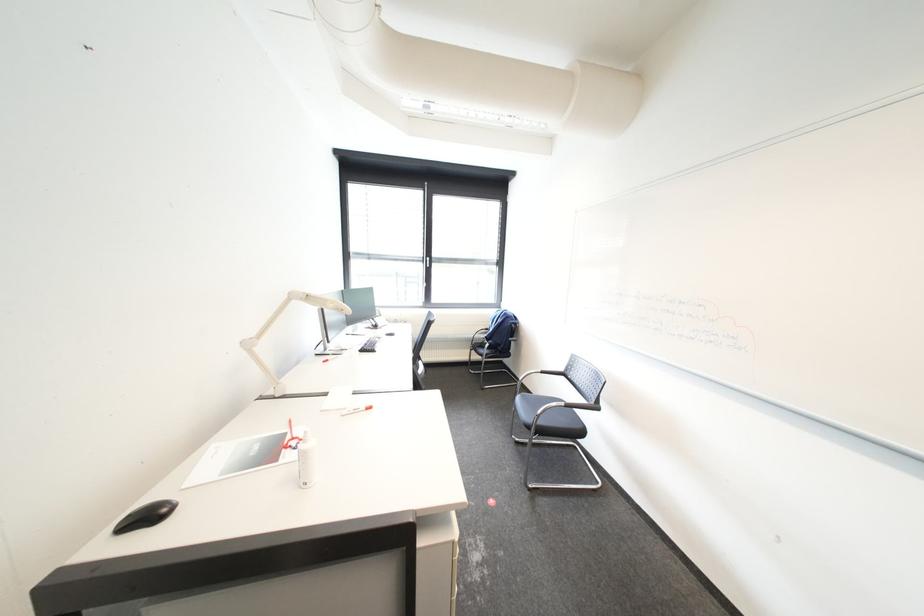
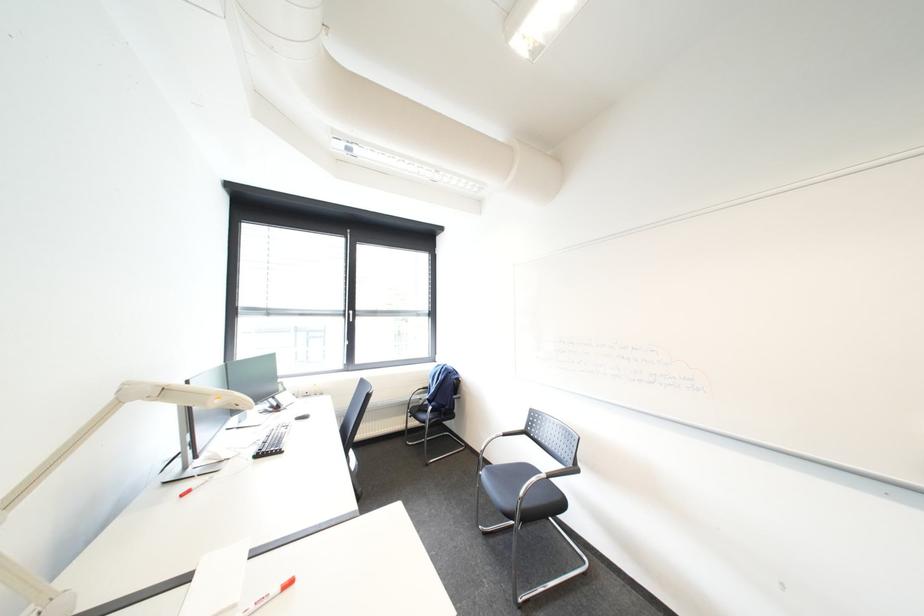
What movement of the cameraman would produce the second image?

The cameraman moved toward left, forward.